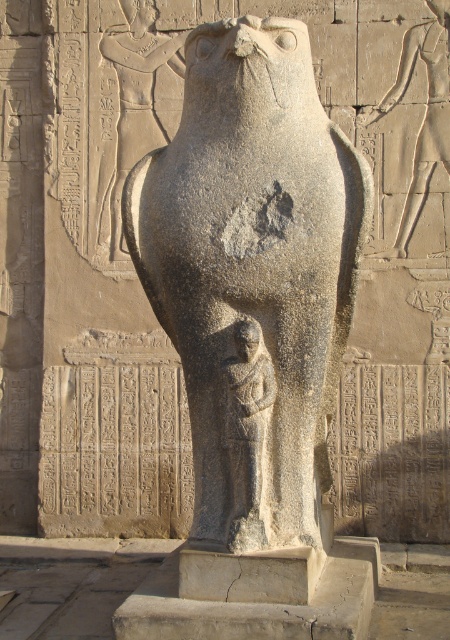
You are an archaeologist examining the ancient Egyptian statue. You need to document the exact position of the gray stone bird at center. What are its coordinates?

The gray stone bird at center is located at point (252, 275).

You are an archaeologist examining the ancient Egyptian artifacts in the image. You see a gray stone bird at center and a gray stone figure at center. Which one do you think is bigger?

The gray stone bird at center is larger in size than the gray stone figure at center.

You are standing in front of the falcon statue and want to know how far the point at coordinate (x=271, y=333) is from you. Can you determine the distance?

The point at coordinate (x=271, y=333) is 3.90 meters away from the camera, so the distance is 3.90 meters.